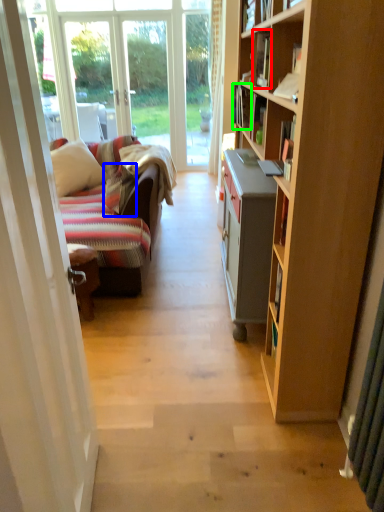
Question: Which object is positioned farthest from book (highlighted by a red box)? Select from pillow (highlighted by a blue box) and book (highlighted by a green box).

Choices:
 (A) pillow
 (B) book

Answer: (A)